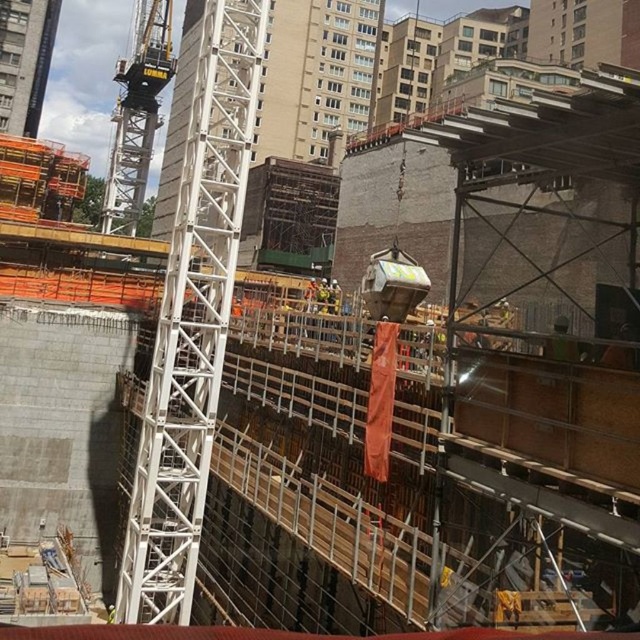
You are a safety inspector assessing the construction site. You need to determine which structure is higher between the white metallic crane at upper left and the white metal tower at upper left. Which one is taller?

The white metallic crane at upper left is much taller than the white metal tower at upper left, so the white metallic crane at upper left is the taller structure.

You are a drone operator trying to capture aerial footage of the construction site. You notice two points marked on your screen at coordinates point (168,352) and point (129,106). Which point should you focus on to ensure it appears larger in your footage?

Point (168,352) is closer to the camera than point (129,106), so focusing on point (168,352) will make it appear larger in the footage.

You are a delivery truck driver who needs to back up your vehicle into the construction site. The entrance to the site is at the bottom left corner. To avoid hitting the white metallic crane at center, you must ensure your truck stays within the 10 meter safety zone marked on the ground. Given that the crane is located at coordinates point 0.503, 0.302, can you safely navigate your truck into the site without entering the safety zone?

The white metallic crane at center is located at point (193, 321). Since the truck must stay within the 10 meter safety zone marked on the ground, and the crane is positioned at the center coordinates, the driver can safely navigate the truck into the site by following the marked path while avoiding the crane area.